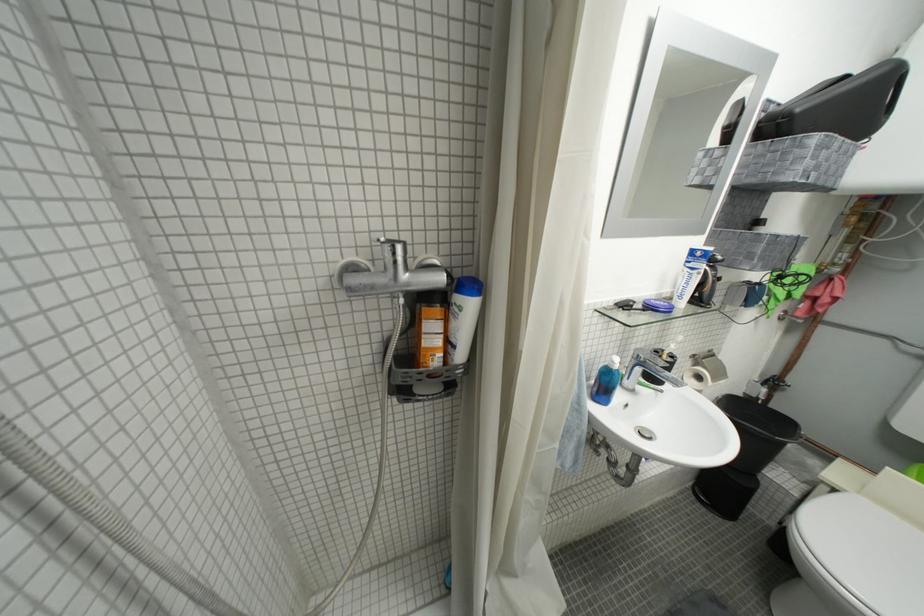
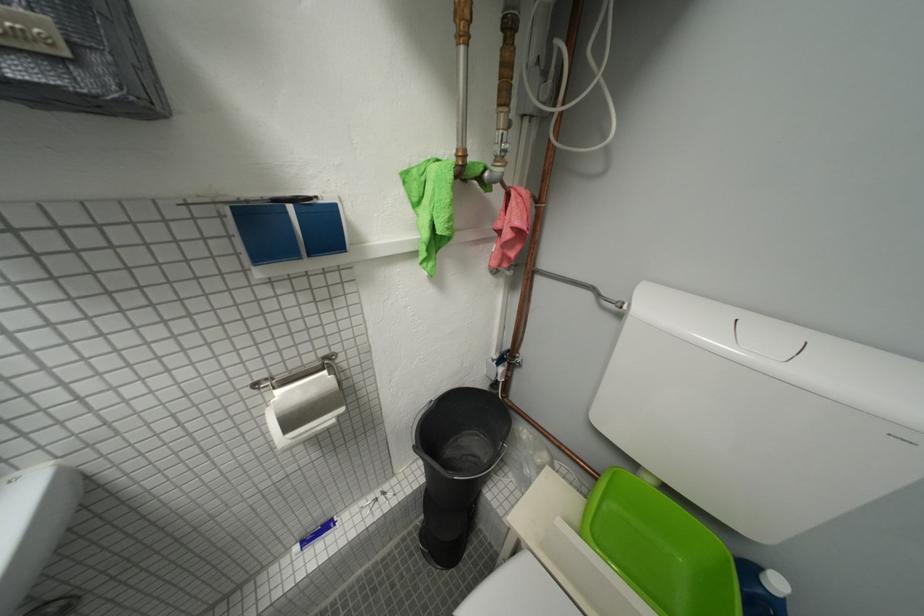
Looking at this image, in a continuous first-person perspective shot, in which direction is the camera moving?

The cameraman moved toward right, forward.